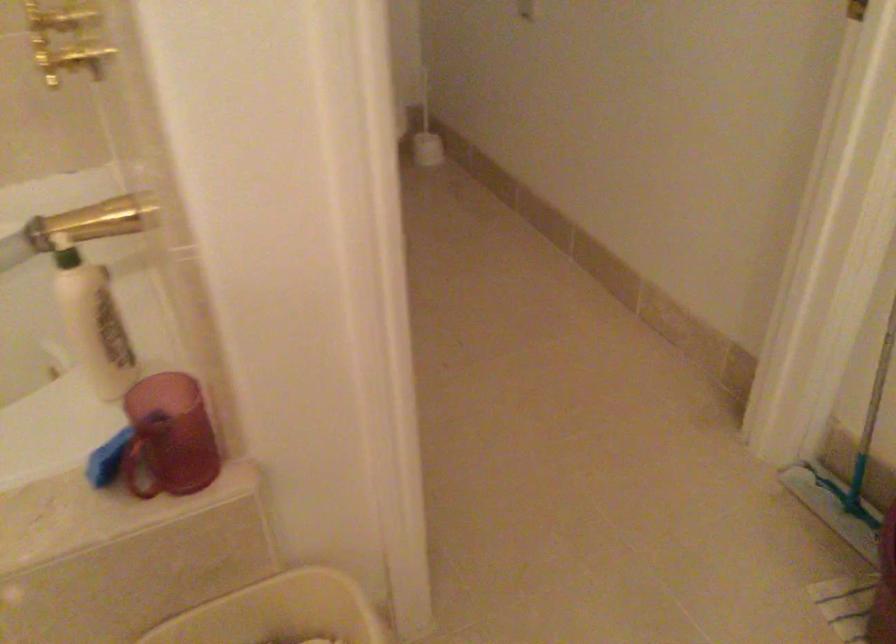
Identify the location of red mug handle. This screenshot has height=644, width=896. (140, 462).